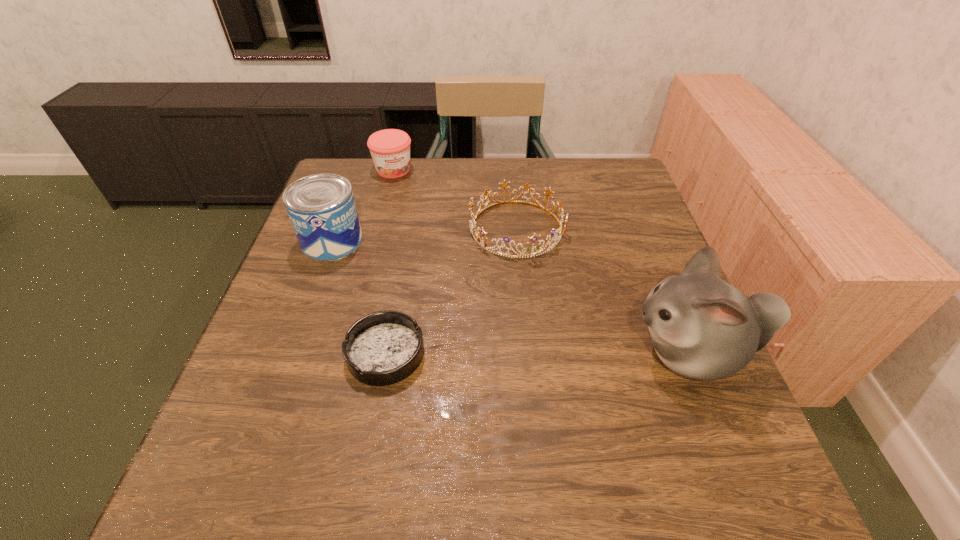
Find the location of a particular element. The width and height of the screenshot is (960, 540). vacant space on the desktop that is between the shortest object and the hamster and is positioned on the front-facing side of the second shortest object is located at coordinates (576, 354).

Identify the location of free space on the desktop that is between the ashtray and the tallest object and is positioned on the front label of the can. This screenshot has width=960, height=540. (493, 354).

The height and width of the screenshot is (540, 960). I want to click on free space on the desktop that is between the ashtray and the rightmost object and is positioned on the front label of the jam, so click(500, 354).